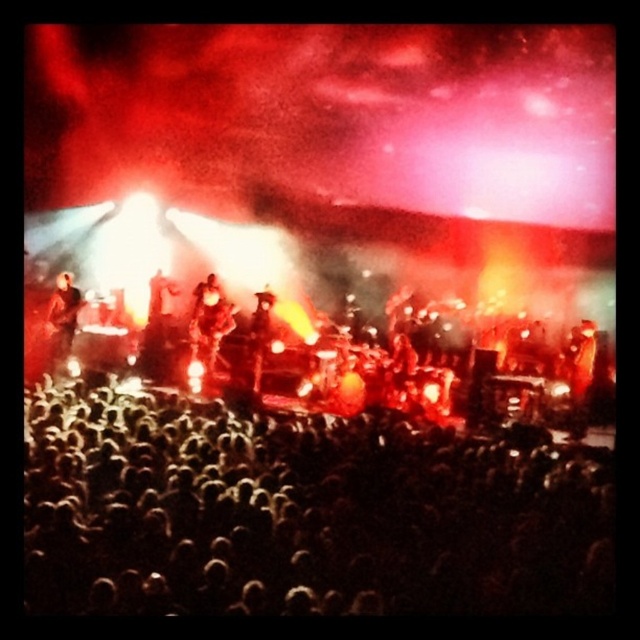
You are a photographer at the concert and want to capture a closeup shot of both the shiny gold guitar at center and the shiny black jacket at center. Since you can only focus on one object at a time, which object should you choose to ensure it appears larger in the photo?

The shiny gold guitar at center should be chosen because its width is larger than the shiny black jacket at center, making it better suited for a closeup to emphasize its size.

You are standing at the back of the concert venue and want to move towards the stage. There are two points marked in the image, point 1 at coordinates point (67, 308) and point 2 at coordinates point (266, 289). Which point should you head towards to get closer to the stage?

Point 1 at coordinates point (67, 308) is in front of point 2 at coordinates point (266, 289), so heading towards point 1 will bring you closer to the stage.